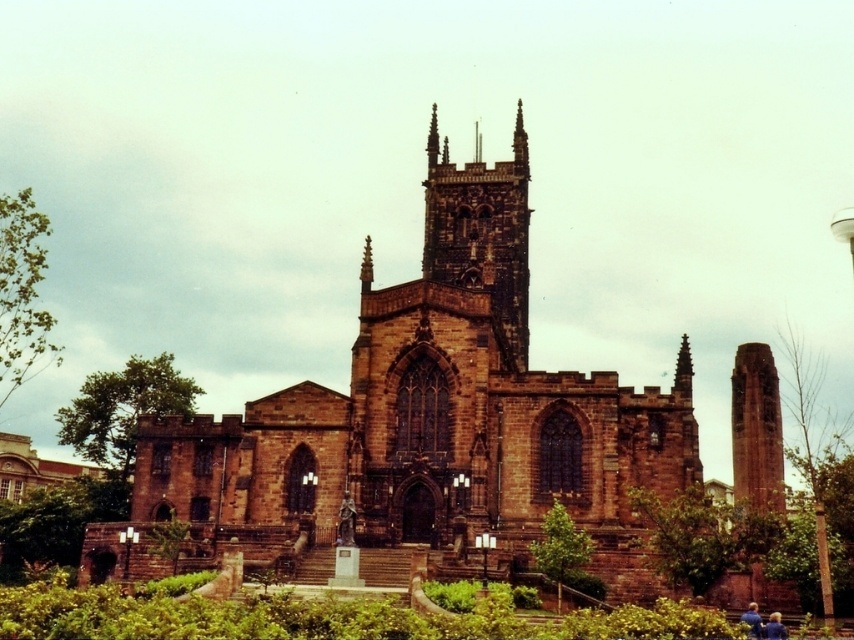
Question: Estimate the real-world distances between objects in this image. Which object is closer to the brown stone tower at center?

Choices:
 (A) brown stone church at center
 (B) red brick tower at center

Answer: (A)

Question: From the image, what is the correct spatial relationship of brown stone church at center in relation to brown stone tower at center?

Choices:
 (A) left
 (B) right

Answer: (B)

Question: In this image, where is brown stone church at center located relative to red brick tower at center?

Choices:
 (A) below
 (B) above

Answer: (B)

Question: Which point is farther to the camera?

Choices:
 (A) brown stone tower at center
 (B) brown stone church at center
 (C) red brick tower at center

Answer: (A)

Question: Is brown stone church at center below red brick tower at center?

Choices:
 (A) no
 (B) yes

Answer: (A)

Question: Which is nearer to the red brick tower at center?

Choices:
 (A) brown stone tower at center
 (B) brown stone church at center

Answer: (B)